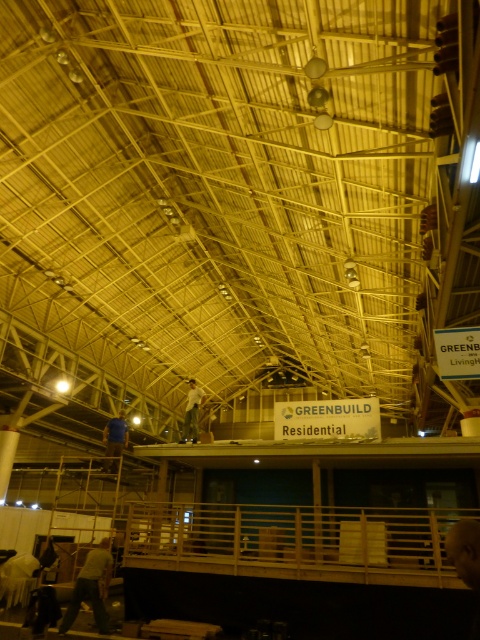
Question: Can you confirm if light gray fabric pants at lower left is positioned to the left of white cotton shirt at center?

Choices:
 (A) no
 (B) yes

Answer: (B)

Question: Which point appears closest to the camera in this image?

Choices:
 (A) (96, 609)
 (B) (192, 440)
 (C) (104, 442)

Answer: (A)

Question: Which is nearer to the white cotton shirt at center?

Choices:
 (A) blue fabric at center
 (B) light gray fabric pants at lower left

Answer: (A)

Question: Does light gray fabric pants at lower left appear over blue fabric at center?

Choices:
 (A) no
 (B) yes

Answer: (A)

Question: Which object appears farthest from the camera in this image?

Choices:
 (A) light gray fabric pants at lower left
 (B) white cotton shirt at center

Answer: (B)

Question: Is the position of blue fabric at center more distant than that of white cotton shirt at center?

Choices:
 (A) no
 (B) yes

Answer: (A)